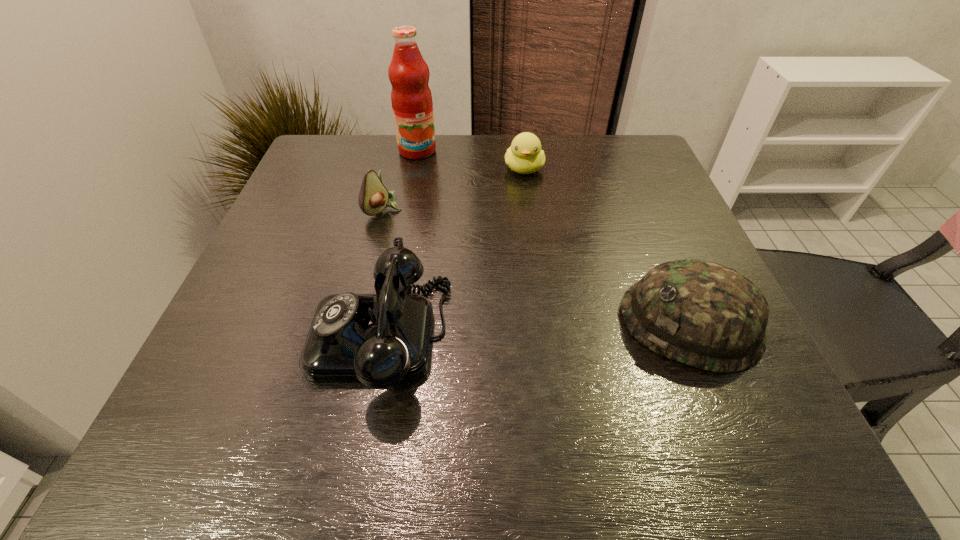
Locate an element on the screen. The image size is (960, 540). vacant space located 0.290m on the seed side of the third nearest object is located at coordinates (494, 281).

Where is `vacant space situated on the seed side of the third nearest object`? This screenshot has width=960, height=540. vacant space situated on the seed side of the third nearest object is located at coordinates (426, 238).

The height and width of the screenshot is (540, 960). I want to click on free space located on the front label of the tallest object, so click(454, 210).

Find the location of `vacant space positioned on the front label of the tallest object`. vacant space positioned on the front label of the tallest object is located at coordinates (446, 198).

Locate an element on the screen. This screenshot has height=540, width=960. free space located on the front label of the tallest object is located at coordinates (482, 253).

You are a GUI agent. You are given a task and a screenshot of the screen. Output one action in this format:
    pyautogui.click(x=<x>, y=<y>)
    Task: Click on the free space located at the beak of the second object from right to left
    This screenshot has height=540, width=960.
    Given the screenshot: What is the action you would take?
    pyautogui.click(x=523, y=220)

You are a GUI agent. You are given a task and a screenshot of the screen. Output one action in this format:
    pyautogui.click(x=<x>, y=<y>)
    Task: Click on the vacant region located at the beak of the second object from right to left
    The width and height of the screenshot is (960, 540).
    Given the screenshot: What is the action you would take?
    pyautogui.click(x=523, y=232)

The height and width of the screenshot is (540, 960). Find the location of `free space located at the beak of the second object from right to left`. free space located at the beak of the second object from right to left is located at coordinates (522, 289).

At what (x,y) coordinates should I click in order to perform the action: click on fruit juice that is at the far edge. Please return your answer as a coordinate pair (x, y). This screenshot has height=540, width=960. Looking at the image, I should click on (411, 98).

This screenshot has height=540, width=960. What are the coordinates of `duckling present at the far edge` in the screenshot? It's located at (525, 156).